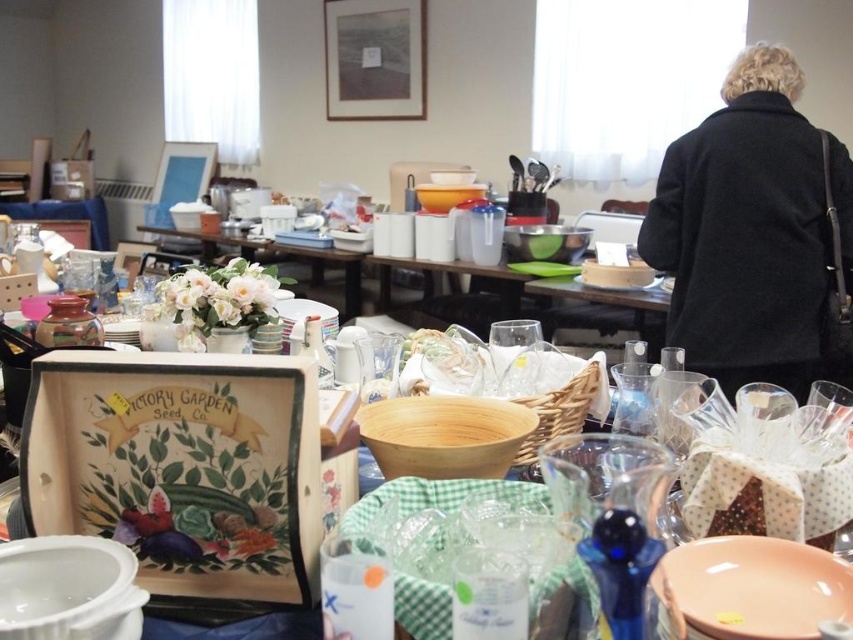
Question: Which point is closer to the camera?

Choices:
 (A) black wool coat at upper right
 (B) matte white plate at center
 (C) white porcelain vase at center

Answer: (A)

Question: Is black wool coat at upper right closer to the viewer compared to white porcelain vase at center?

Choices:
 (A) no
 (B) yes

Answer: (B)

Question: Among these objects, which one is farthest from the camera?

Choices:
 (A) black wool coat at upper right
 (B) white porcelain vase at center

Answer: (B)

Question: Is white porcelain vase at center below matte white plate at center?

Choices:
 (A) no
 (B) yes

Answer: (A)

Question: In this image, where is white porcelain vase at center located relative to matte white plate at center?

Choices:
 (A) right
 (B) left

Answer: (B)

Question: Which object appears farthest from the camera in this image?

Choices:
 (A) white porcelain vase at center
 (B) matte white plate at center

Answer: (A)